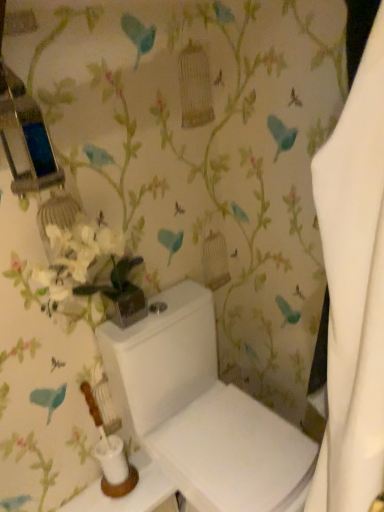
Question: Are white glossy toilet at center and white glossy toilet tank at lower center making contact?

Choices:
 (A) yes
 (B) no

Answer: (B)

Question: Is white glossy toilet at center wider than white glossy toilet tank at lower center?

Choices:
 (A) no
 (B) yes

Answer: (B)

Question: Considering the relative sizes of white glossy toilet at center and white glossy toilet tank at lower center in the image provided, is white glossy toilet at center shorter than white glossy toilet tank at lower center?

Choices:
 (A) yes
 (B) no

Answer: (B)

Question: From the image's perspective, is white glossy toilet at center above white glossy toilet tank at lower center?

Choices:
 (A) yes
 (B) no

Answer: (A)

Question: Is white glossy toilet at center positioned beyond the bounds of white glossy toilet tank at lower center?

Choices:
 (A) no
 (B) yes

Answer: (B)

Question: Is white glossy toilet at center thinner than white glossy toilet tank at lower center?

Choices:
 (A) yes
 (B) no

Answer: (B)

Question: Considering the relative sizes of white glossy toilet tank at lower center and white glossy toilet at center in the image provided, is white glossy toilet tank at lower center thinner than white glossy toilet at center?

Choices:
 (A) yes
 (B) no

Answer: (A)

Question: Is white glossy toilet tank at lower center facing towards white glossy toilet at center?

Choices:
 (A) no
 (B) yes

Answer: (A)

Question: From the image's perspective, is white glossy toilet tank at lower center on top of white glossy toilet at center?

Choices:
 (A) yes
 (B) no

Answer: (B)

Question: Does white glossy toilet tank at lower center have a greater height compared to white glossy toilet at center?

Choices:
 (A) no
 (B) yes

Answer: (A)

Question: Is white glossy toilet tank at lower center at the left side of white glossy toilet at center?

Choices:
 (A) no
 (B) yes

Answer: (B)

Question: Is white glossy toilet tank at lower center outside of white glossy toilet at center?

Choices:
 (A) no
 (B) yes

Answer: (B)

Question: Relative to white glossy toilet at center, is white glossy toilet tank at lower center in front or behind?

Choices:
 (A) front
 (B) behind

Answer: (B)